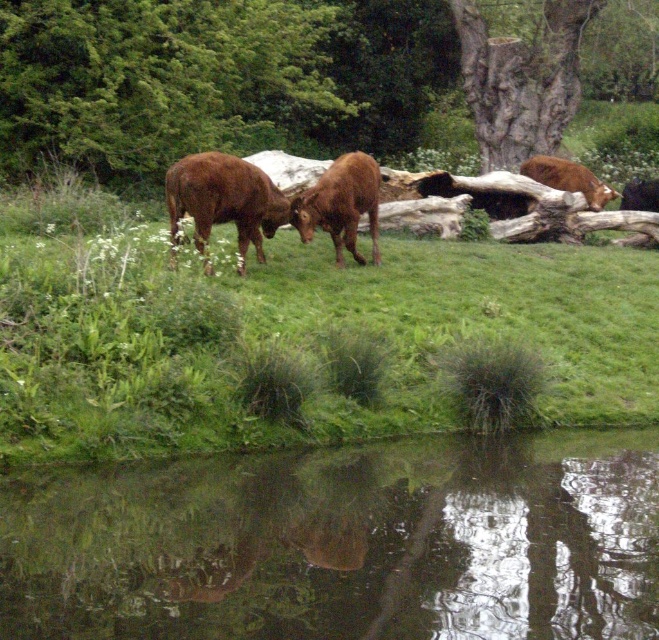
You are a photographer standing at the water edge. You want to take a photo of the brown matte cow at center without the smooth bark tree at upper center blocking it. Can you move forward to achieve this?

The brown matte cow at center is behind the smooth bark tree at upper center. Moving forward would bring the cow closer but might not eliminate the tree obstruction unless you move far enough to the side or back, but according to the description, the cow is behind the tree, so moving forward might not resolve the blockage. However, the scene mentions the tree is at upper center and the cow is at center. If moving forward, the perspective might change so the tree no longer blocks the cow. But based on the 2D

You are standing at the origin point of the image coordinate system. The brown matte cow at center is located at point 0.320, 0.519. If you want to walk directly towards it, in which direction should you move?

You should move towards the point (341,204) to reach the brown matte cow at center.

You are an artist trying to paint this scene. You want to ensure the transparent water at center and the smooth bark tree trunk at upper center are proportionally accurate. Which object should you paint first if you want to start with the taller one?

The smooth bark tree trunk at upper center should be painted first because it is taller than the transparent water at center.